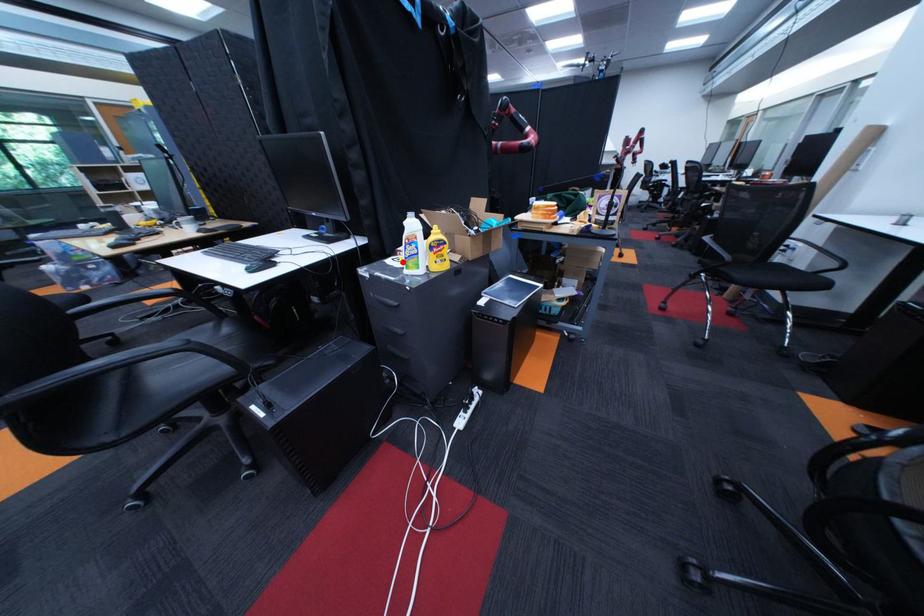
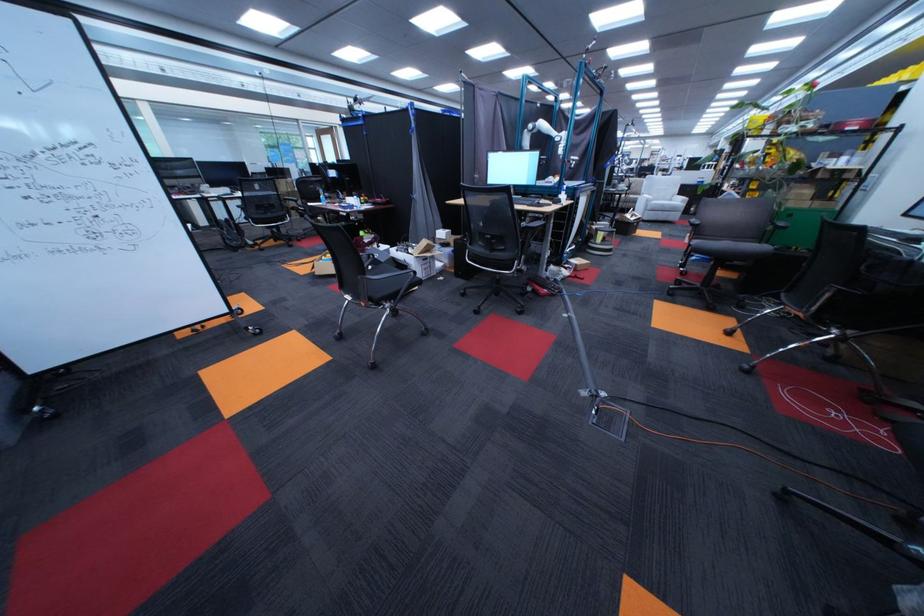
Question: I am providing you with two images of the same scene from different viewpoints. A red point is marked on the first image. Is the red point's position out of view in image 2?

Choices:
 (A) Yes
 (B) No

Answer: (A)